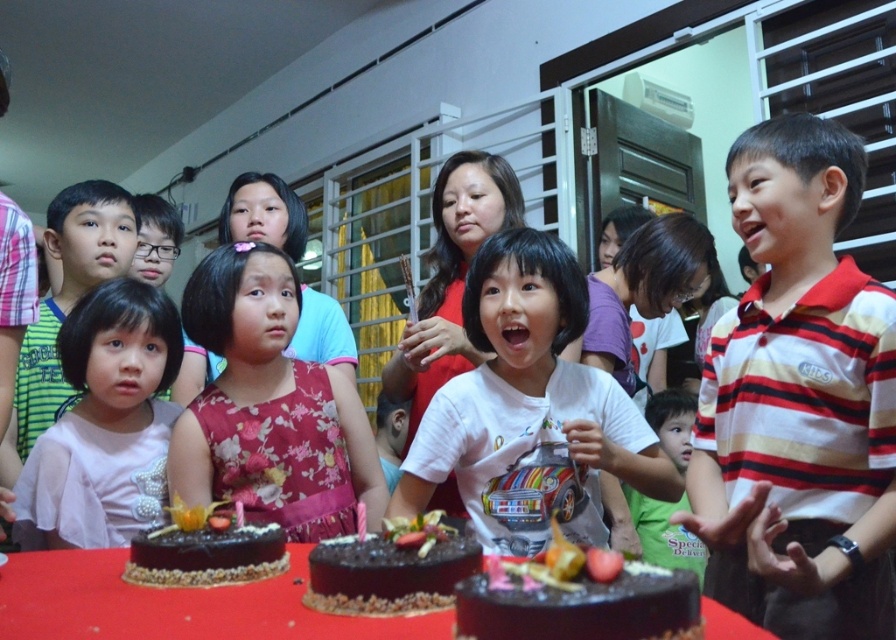
Question: Does chocolate frosted cake at lower left have a greater width compared to green cotton shirt at center?

Choices:
 (A) yes
 (B) no

Answer: (B)

Question: Which of the following is the farthest from the observer?

Choices:
 (A) (435, 586)
 (B) (350, 356)
 (C) (192, 529)
 (D) (47, 380)

Answer: (B)

Question: Which object appears closest to the camera in this image?

Choices:
 (A) pink fabric dress at lower left
 (B) pink satin dress at center
 (C) pink floral dress at center

Answer: (C)

Question: From the image, what is the correct spatial relationship of chocolate matte cake at center in relation to chocolatesmoothcake at center?

Choices:
 (A) left
 (B) right

Answer: (B)

Question: Does striped cotton shirt at right appear on the right side of white matte shirt at center?

Choices:
 (A) no
 (B) yes

Answer: (B)

Question: Which point is farther to the camera?

Choices:
 (A) pink satin dress at center
 (B) white matte shirt at center

Answer: (A)